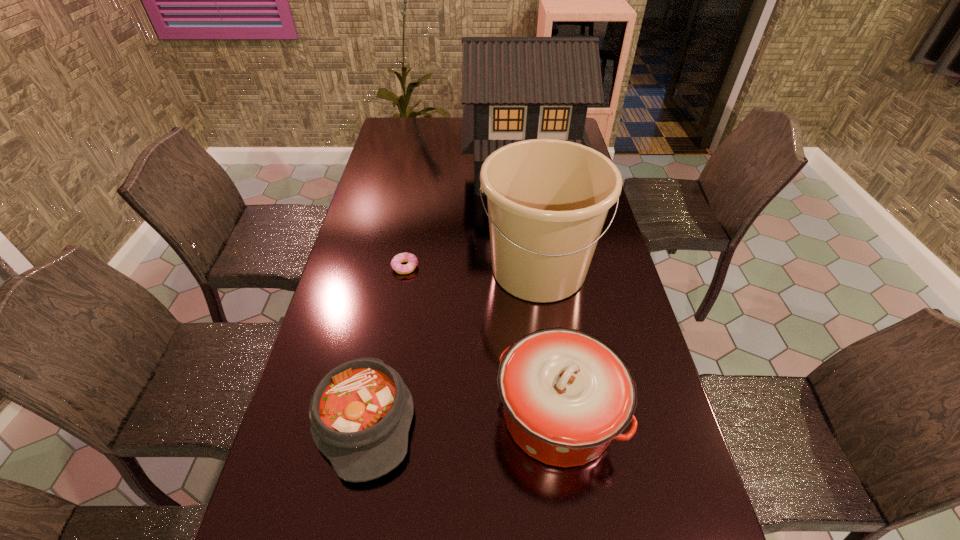
Locate an element on the screen. the farthest object is located at coordinates (514, 88).

This screenshot has height=540, width=960. Find the location of `dollhouse`. dollhouse is located at coordinates (514, 88).

Identify the location of the second tallest object. coord(548,199).

Locate an element on the screen. The image size is (960, 540). the taller casserole is located at coordinates (566, 394).

The image size is (960, 540). What are the coordinates of `the right casserole` in the screenshot? It's located at (566, 394).

Locate an element on the screen. This screenshot has width=960, height=540. the shorter casserole is located at coordinates (360, 413).

Where is `the fourth tallest object`? The height and width of the screenshot is (540, 960). the fourth tallest object is located at coordinates (360, 413).

Where is `doughnut`? The height and width of the screenshot is (540, 960). doughnut is located at coordinates (412, 260).

This screenshot has width=960, height=540. Find the location of `vacant region located 0.300m on the front-facing side of the dollhouse`. vacant region located 0.300m on the front-facing side of the dollhouse is located at coordinates (532, 259).

The width and height of the screenshot is (960, 540). What are the coordinates of `free space located 0.170m on the back of the bucket` in the screenshot? It's located at (530, 203).